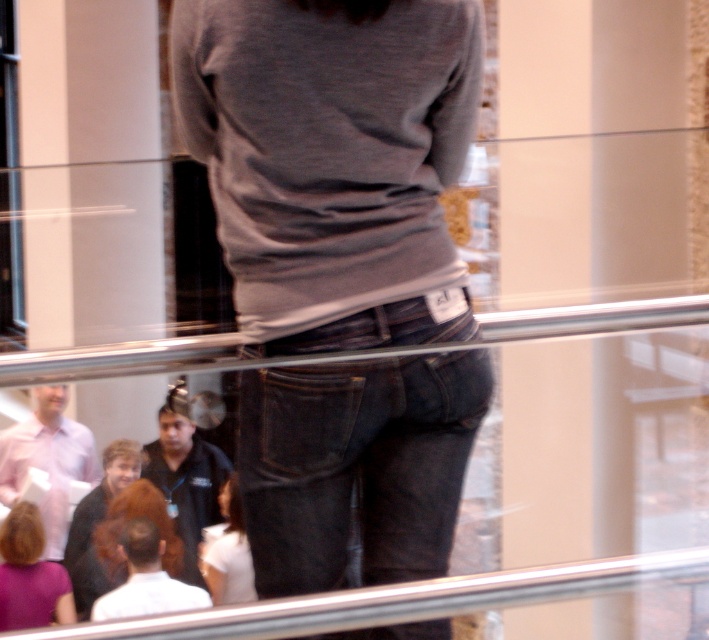
Question: Which of the following is the closest to the observer?

Choices:
 (A) (242, 561)
 (B) (289, 506)
 (C) (18, 556)

Answer: (B)

Question: Does purple matte hair at lower left appear on the left side of white matte shirt at center?

Choices:
 (A) no
 (B) yes

Answer: (B)

Question: Among these points, which one is nearest to the camera?

Choices:
 (A) (67, 612)
 (B) (352, 376)
 (C) (230, 480)

Answer: (B)

Question: Among these objects, which one is farthest from the camera?

Choices:
 (A) white matte shirt at center
 (B) purple matte hair at lower left

Answer: (A)

Question: Does purple matte hair at lower left appear over white matte shirt at center?

Choices:
 (A) yes
 (B) no

Answer: (B)

Question: Can you confirm if purple matte hair at lower left is positioned below white matte shirt at center?

Choices:
 (A) yes
 (B) no

Answer: (A)